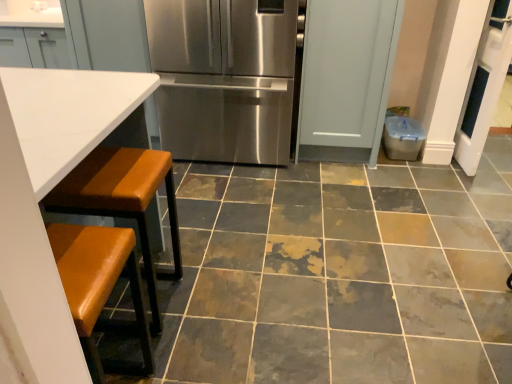
You are a GUI agent. You are given a task and a screenshot of the screen. Output one action in this format:
    pyautogui.click(x=<x>, y=<y>)
    Task: Click on the free space to the back side of brown leather stool at lower left
    
    Given the screenshot: What is the action you would take?
    pyautogui.click(x=183, y=253)